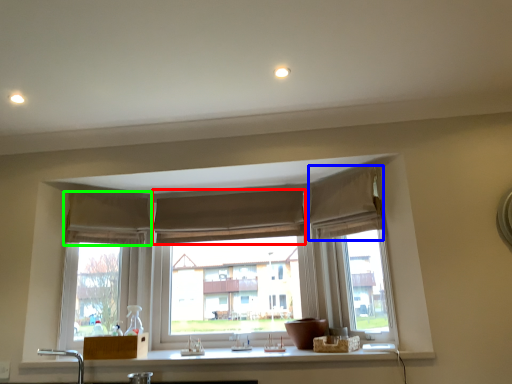
Question: Based on their relative distances, which object is farther from curtain (highlighted by a red box)? Choose from curtain (highlighted by a blue box) and curtain (highlighted by a green box).

Choices:
 (A) curtain
 (B) curtain

Answer: (A)